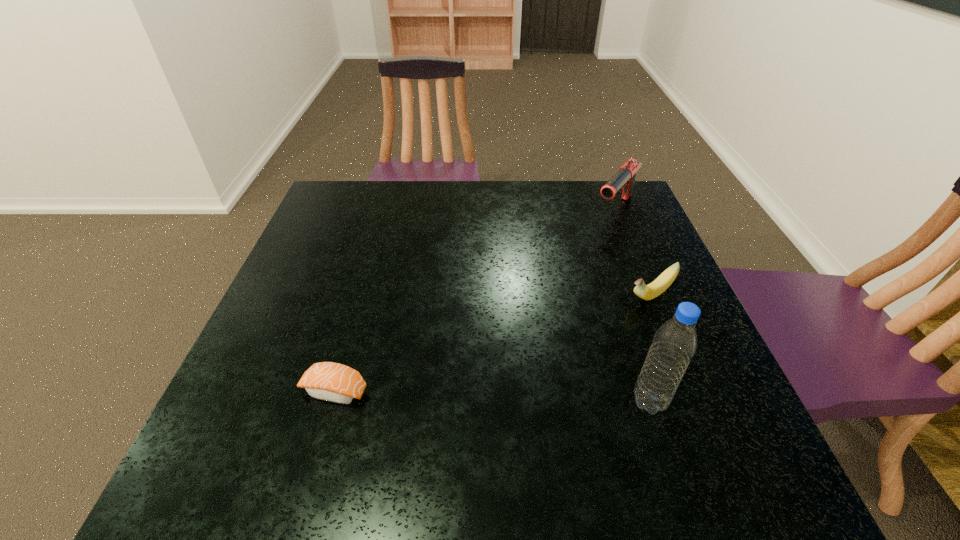
Find the location of a particular element. the second closest object to the banana is located at coordinates (624, 179).

At what (x,y) coordinates should I click in order to perform the action: click on object that stands as the closest to the leftmost object. Please return your answer as a coordinate pair (x, y). This screenshot has width=960, height=540. Looking at the image, I should click on (675, 342).

This screenshot has height=540, width=960. I want to click on vacant point that satisfies the following two spatial constraints: 1. on the front side of the water bottle; 2. on the right side of the shortest object, so click(x=331, y=402).

Find the location of a particular element. This screenshot has width=960, height=540. vacant point that satisfies the following two spatial constraints: 1. on the back side of the leftmost object; 2. on the left side of the second shortest object is located at coordinates (362, 295).

At what (x,y) coordinates should I click in order to perform the action: click on free location that satisfies the following two spatial constraints: 1. on the back side of the water bottle; 2. on the left side of the banana. Please return your answer as a coordinate pair (x, y). The image size is (960, 540). Looking at the image, I should click on (614, 295).